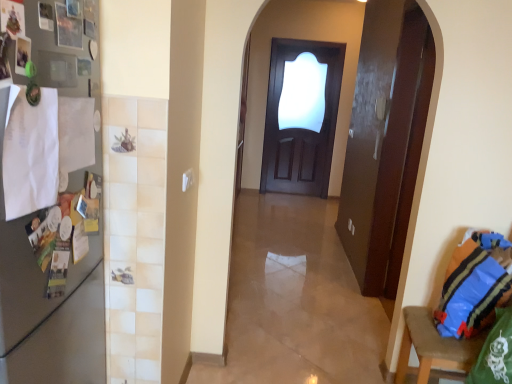
Question: Should I look upward or downward to see blue striped fabric pillow at right?

Choices:
 (A) up
 (B) down

Answer: (B)

Question: Does blue fabric bag at lower right have a smaller size compared to dark wood door at center?

Choices:
 (A) no
 (B) yes

Answer: (B)

Question: Is blue fabric bag at lower right thinner than dark wood door at center?

Choices:
 (A) no
 (B) yes

Answer: (A)

Question: Does blue fabric bag at lower right touch dark wood door at center?

Choices:
 (A) no
 (B) yes

Answer: (A)

Question: Does blue fabric bag at lower right have a larger size compared to dark wood door at center?

Choices:
 (A) no
 (B) yes

Answer: (A)

Question: Can we say blue fabric bag at lower right lies outside dark wood door at center?

Choices:
 (A) no
 (B) yes

Answer: (B)

Question: Would you say blue fabric bag at lower right is a long distance from dark wood door at center?

Choices:
 (A) yes
 (B) no

Answer: (A)

Question: Is satin silver fridge at left not close to dark wood door at center?

Choices:
 (A) no
 (B) yes

Answer: (B)

Question: From a real-world perspective, does satin silver fridge at left sit lower than dark wood door at center?

Choices:
 (A) no
 (B) yes

Answer: (B)

Question: From the image's perspective, would you say satin silver fridge at left is shown under dark wood door at center?

Choices:
 (A) no
 (B) yes

Answer: (B)

Question: Considering the relative sizes of satin silver fridge at left and dark wood door at center in the image provided, is satin silver fridge at left taller than dark wood door at center?

Choices:
 (A) no
 (B) yes

Answer: (A)

Question: Is satin silver fridge at left in front of dark wood door at center?

Choices:
 (A) no
 (B) yes

Answer: (B)

Question: Is satin silver fridge at left at the right side of dark wood door at center?

Choices:
 (A) no
 (B) yes

Answer: (A)

Question: Does satin silver fridge at left come in front of blue striped fabric pillow at right?

Choices:
 (A) no
 (B) yes

Answer: (B)